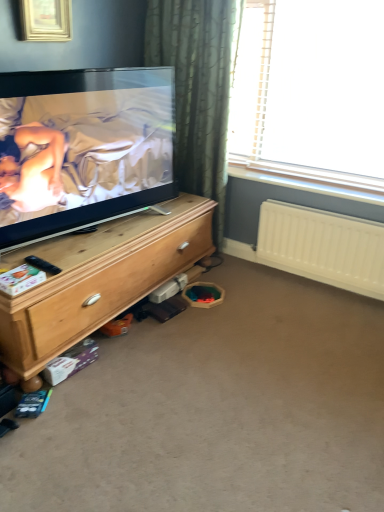
In order to face matte black tv at left, should I rotate leftwards or rightwards?

A 13.308 degree turn to the left will do.

What do you see at coordinates (218, 409) in the screenshot? I see `carpet at lower center` at bounding box center [218, 409].

In order to click on transparent plastic window at upper right in this screenshot , I will do `click(311, 91)`.

This screenshot has width=384, height=512. Describe the element at coordinates (97, 280) in the screenshot. I see `wooden chest of drawers at left` at that location.

Locate an element on the screen. Image resolution: width=384 pixels, height=512 pixels. black plastic remote control at lower left is located at coordinates (42, 265).

Is wooden chest of drawers at left looking in the opposite direction of white plastic radiator at lower right?

That's not correct — wooden chest of drawers at left is not looking away from white plastic radiator at lower right.

Is wooden chest of drawers at left closer to camera compared to white plastic radiator at lower right?

Yes, the depth of wooden chest of drawers at left is less than that of white plastic radiator at lower right.

Considering the sizes of wooden chest of drawers at left and white plastic radiator at lower right in the image, is wooden chest of drawers at left bigger or smaller than white plastic radiator at lower right?

Clearly, wooden chest of drawers at left is larger in size than white plastic radiator at lower right.

Which is more to the right, matte black tv at left or carpet at lower center?

carpet at lower center.

Considering the points (141, 191) and (299, 305), which point is behind, point (141, 191) or point (299, 305)?

The point (299, 305) is more distant.

Does matte black tv at left have a greater width compared to carpet at lower center?

No.

Is matte black tv at left looking in the opposite direction of carpet at lower center?

That's not correct — matte black tv at left is not looking away from carpet at lower center.

How many degrees apart are the facing directions of black plastic remote control at lower left and transparent plastic window at upper right?

84.1 degrees.

From the image's perspective, who appears lower, black plastic remote control at lower left or transparent plastic window at upper right?

From the image's view, black plastic remote control at lower left is below.

Is transparent plastic window at upper right at the back of black plastic remote control at lower left?

black plastic remote control at lower left does not have its back to transparent plastic window at upper right.

Is black plastic remote control at lower left positioned before transparent plastic window at upper right?

Yes, the depth of black plastic remote control at lower left is less than that of transparent plastic window at upper right.

Is gold metallic picture frame at upper left not within transparent plastic window at upper right?

Absolutely, gold metallic picture frame at upper left is external to transparent plastic window at upper right.

Are gold metallic picture frame at upper left and transparent plastic window at upper right located far from each other?

gold metallic picture frame at upper left is positioned a significant distance from transparent plastic window at upper right.

From a real-world perspective, between gold metallic picture frame at upper left and transparent plastic window at upper right, who is vertically higher?

gold metallic picture frame at upper left is physically above.

You are a GUI agent. You are given a task and a screenshot of the screen. Output one action in this format:
    pyautogui.click(x=<x>, y=<y>)
    Task: Click on the picture frame located on the left of transparent plastic window at upper right
    The width and height of the screenshot is (384, 512).
    Given the screenshot: What is the action you would take?
    pyautogui.click(x=46, y=20)

Is wooden chest of drawers at left far away from gold metallic picture frame at upper left?

Yes, wooden chest of drawers at left and gold metallic picture frame at upper left are located far from each other.

Which object is further away from the camera, wooden chest of drawers at left or gold metallic picture frame at upper left?

gold metallic picture frame at upper left is further from the camera.

Looking at this image, is wooden chest of drawers at left taller than gold metallic picture frame at upper left?

Yes.

What's the angular difference between wooden chest of drawers at left and gold metallic picture frame at upper left's facing directions?

1.91 degrees.

From the image's perspective, does white plastic radiator at lower right appear lower than carpet at lower center?

No, from the image's perspective, white plastic radiator at lower right is not beneath carpet at lower center.

Considering the sizes of objects white plastic radiator at lower right and carpet at lower center in the image provided, who is taller, white plastic radiator at lower right or carpet at lower center?

white plastic radiator at lower right.

Between white plastic radiator at lower right and carpet at lower center, which one appears on the left side from the viewer's perspective?

Positioned to the left is carpet at lower center.

Consider the image. From a real-world perspective, is white plastic radiator at lower right physically located above or below carpet at lower center?

From a real-world perspective, white plastic radiator at lower right is physically above carpet at lower center.

From a real-world perspective, between transparent plastic window at upper right and gold metallic picture frame at upper left, who is vertically higher?

gold metallic picture frame at upper left, from a real-world perspective.

From the image's perspective, is transparent plastic window at upper right located above gold metallic picture frame at upper left?

Incorrect, from the image's perspective, transparent plastic window at upper right is lower than gold metallic picture frame at upper left.

Can we say transparent plastic window at upper right lies outside gold metallic picture frame at upper left?

Yes, transparent plastic window at upper right is not within gold metallic picture frame at upper left.

Is transparent plastic window at upper right in contact with gold metallic picture frame at upper left?

No, transparent plastic window at upper right is not making contact with gold metallic picture frame at upper left.

In order to click on radiator above the wooden chest of drawers at left (from a real-world perspective) in this screenshot , I will do `click(323, 247)`.

Where is `plain below the matte black tv at left (from a real-world perspective)`? Image resolution: width=384 pixels, height=512 pixels. plain below the matte black tv at left (from a real-world perspective) is located at coordinates (218, 409).

Based on their spatial positions, is gold metallic picture frame at upper left or carpet at lower center further from wooden chest of drawers at left?

Among the two, gold metallic picture frame at upper left is located further to wooden chest of drawers at left.

Which object lies nearer to the anchor point white plastic radiator at lower right, wooden chest of drawers at left or gold metallic picture frame at upper left?

Among the two, wooden chest of drawers at left is located nearer to white plastic radiator at lower right.

Estimate the real-world distances between objects in this image. Which object is further from carpet at lower center, white plastic radiator at lower right or matte black tv at left?

matte black tv at left is further to carpet at lower center.

Based on their spatial positions, is carpet at lower center or gold metallic picture frame at upper left further from wooden chest of drawers at left?

gold metallic picture frame at upper left lies further to wooden chest of drawers at left than the other object.

Which object lies further to the anchor point gold metallic picture frame at upper left, carpet at lower center or matte black tv at left?

The object further to gold metallic picture frame at upper left is carpet at lower center.

From the image, which object appears to be nearer to white plastic radiator at lower right, black plastic remote control at lower left or wooden chest of drawers at left?

wooden chest of drawers at left lies closer to white plastic radiator at lower right than the other object.

Based on their spatial positions, is white plastic radiator at lower right or gold metallic picture frame at upper left closer to wooden chest of drawers at left?

white plastic radiator at lower right.

When comparing their distances from black plastic remote control at lower left, does white plastic radiator at lower right or carpet at lower center seem closer?

carpet at lower center is closer to black plastic remote control at lower left.

Locate an element on the screen. The width and height of the screenshot is (384, 512). remote control between matte black tv at left and carpet at lower center in the up-down direction is located at coordinates (42, 265).

Where is `the chest of drawers situated between matte black tv at left and white plastic radiator at lower right from left to right`? The width and height of the screenshot is (384, 512). the chest of drawers situated between matte black tv at left and white plastic radiator at lower right from left to right is located at coordinates (97, 280).

Locate an element on the screen. plain located between black plastic remote control at lower left and white plastic radiator at lower right in the left-right direction is located at coordinates coord(218,409).

Find the location of a particular element. The image size is (384, 512). remote control between matte black tv at left and wooden chest of drawers at left in the up-down direction is located at coordinates (42, 265).